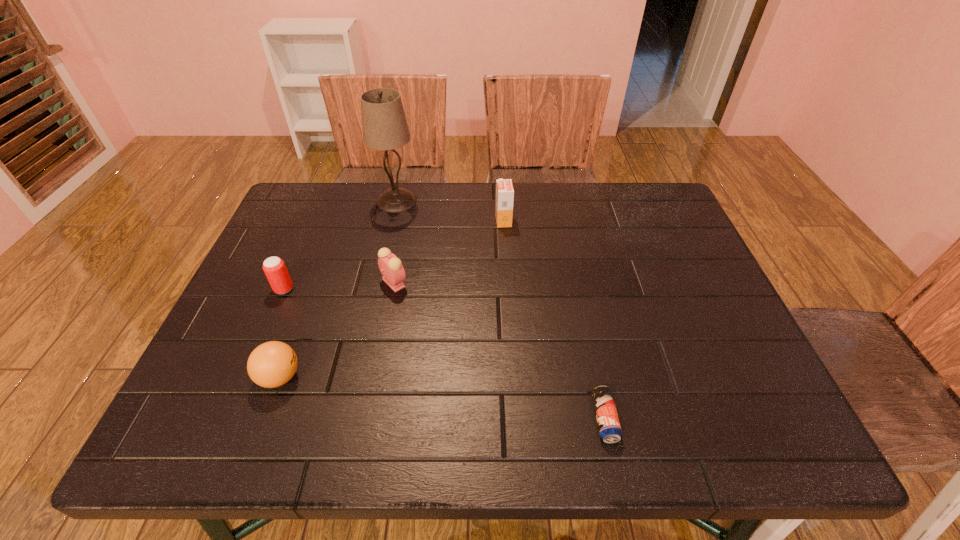
Where is `ping-pong ball that is at the left edge`? This screenshot has width=960, height=540. ping-pong ball that is at the left edge is located at coordinates (272, 364).

This screenshot has width=960, height=540. Find the location of `vacant area at the far edge of the desktop`. vacant area at the far edge of the desktop is located at coordinates (587, 184).

In the image, there is a desktop. Where is `blank space at the near edge`? The width and height of the screenshot is (960, 540). blank space at the near edge is located at coordinates (649, 431).

You are a GUI agent. You are given a task and a screenshot of the screen. Output one action in this format:
    pyautogui.click(x=<x>, y=<y>)
    Task: Click on the vacant space at the left edge
    This screenshot has width=960, height=540.
    Given the screenshot: What is the action you would take?
    pyautogui.click(x=316, y=239)

I want to click on vacant space at the right edge of the desktop, so click(670, 313).

Image resolution: width=960 pixels, height=540 pixels. In order to click on free spot at the far left corner of the desktop in this screenshot , I will do `click(333, 220)`.

You are a GUI agent. You are given a task and a screenshot of the screen. Output one action in this format:
    pyautogui.click(x=<x>, y=<y>)
    Task: Click on the free space between the fifth object from right to left and the taller beer can
    This screenshot has height=540, width=960.
    Given the screenshot: What is the action you would take?
    pyautogui.click(x=282, y=333)

At what (x,y) coordinates should I click in order to perform the action: click on free space between the orange juice and the tallest object. Please return your answer as a coordinate pair (x, y). Image resolution: width=960 pixels, height=540 pixels. Looking at the image, I should click on (450, 211).

Locate an element on the screen. This screenshot has height=540, width=960. free space between the farthest object and the orange juice is located at coordinates (450, 211).

Image resolution: width=960 pixels, height=540 pixels. Find the location of `free spot between the tallest object and the ping-pong ball`. free spot between the tallest object and the ping-pong ball is located at coordinates (338, 289).